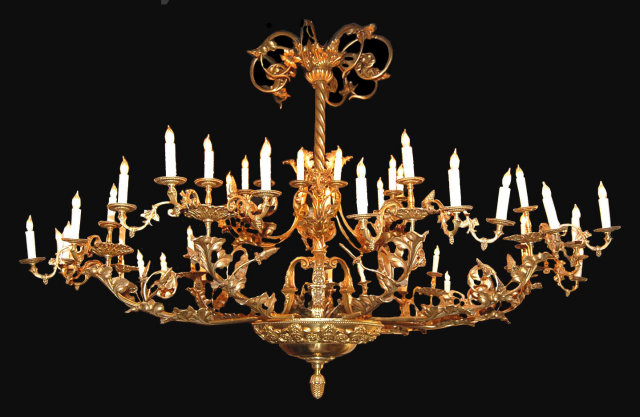
Where is `base of chandelier`? base of chandelier is located at coordinates (326, 61).